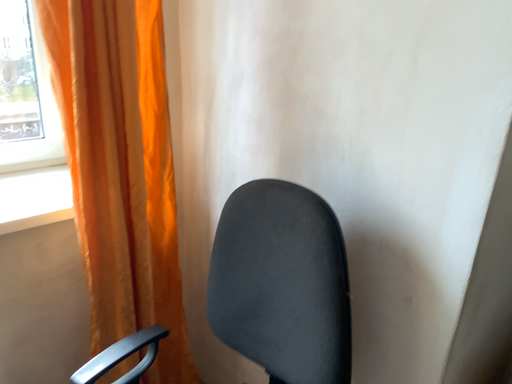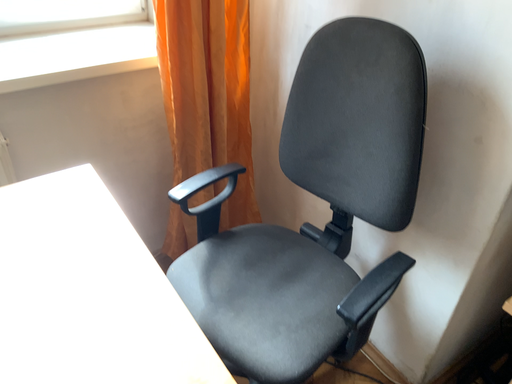
Question: How did the camera likely rotate when shooting the video?

Choices:
 (A) rotated upward
 (B) rotated downward

Answer: (B)